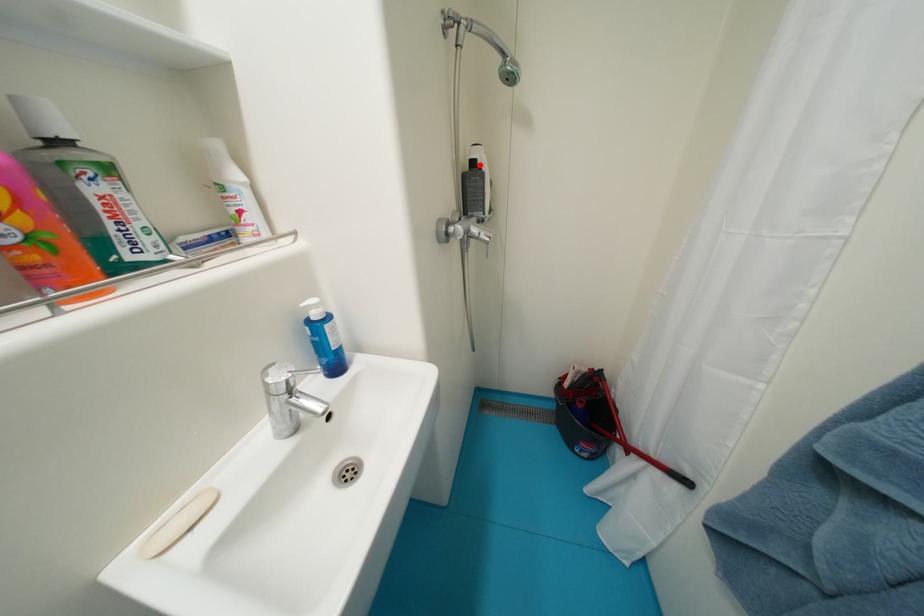
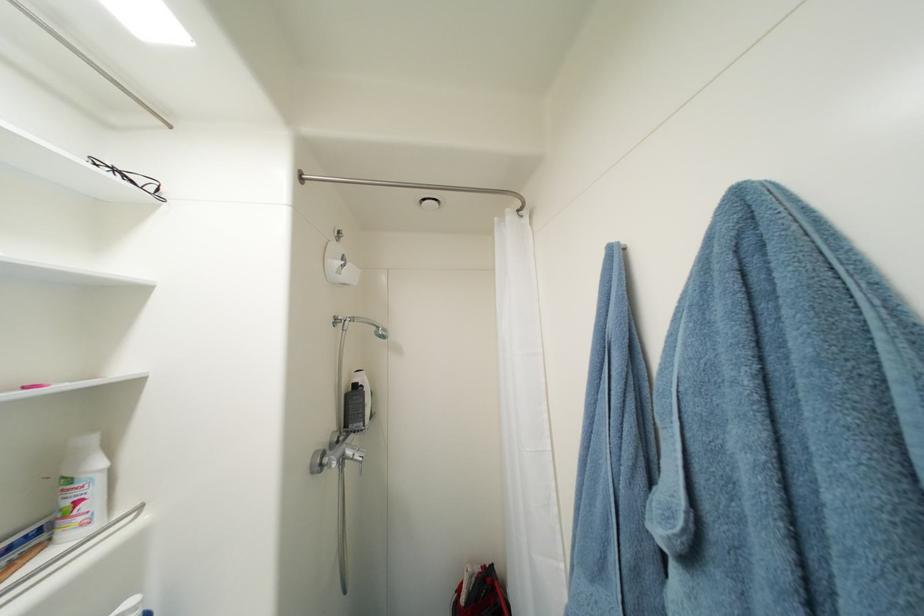
The point at the highlighted location is marked in the first image. Where is the corresponding point in the second image?

(361, 387)